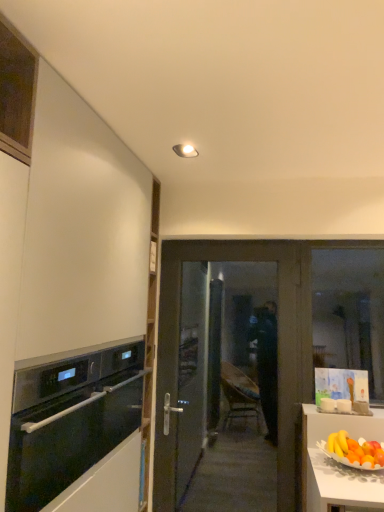
Measure the distance between orange matte grapefruit at right and camera.

The depth of orange matte grapefruit at right is 1.96 meters.

What do you see at coordinates (70, 419) in the screenshot? The height and width of the screenshot is (512, 384). I see `black glass oven at left` at bounding box center [70, 419].

The height and width of the screenshot is (512, 384). Describe the element at coordinates (185, 151) in the screenshot. I see `matte white ceiling light at upper center` at that location.

Describe the element at coordinates (350, 312) in the screenshot. Image resolution: width=384 pixels, height=512 pixels. I see `transparent glass window at right` at that location.

What is the approximate height of matte dark brown door at center?

matte dark brown door at center is 1.67 meters in height.

The height and width of the screenshot is (512, 384). Describe the element at coordinates (279, 341) in the screenshot. I see `matte dark brown door at center` at that location.

The height and width of the screenshot is (512, 384). In order to click on orange matte grapefruit at right in this screenshot , I will do `click(352, 452)`.

Is point (321, 254) closer or farther from the camera than point (185, 151)?

Point (321, 254) is positioned farther from the camera compared to point (185, 151).

Is transparent glass window at right spatially inside matte white ceiling light at upper center, or outside of it?

transparent glass window at right is not inside matte white ceiling light at upper center, it's outside.

Is transparent glass window at right facing towards matte white ceiling light at upper center?

No, transparent glass window at right is not oriented towards matte white ceiling light at upper center.

The image size is (384, 512). I want to click on window that is behind the matte white ceiling light at upper center, so click(x=350, y=312).

From the image's perspective, is transparent glass window at right on top of matte dark brown door at center?

Yes, from the image's perspective, transparent glass window at right is on top of matte dark brown door at center.

How far apart are transparent glass window at right and matte dark brown door at center?

74.02 centimeters.

Is transparent glass window at right to the left of matte dark brown door at center from the viewer's perspective?

No, transparent glass window at right is not to the left of matte dark brown door at center.

The image size is (384, 512). Identify the location of window behind the matte dark brown door at center. (350, 312).

Locate an element on the screen. window located on the right of matte dark brown door at center is located at coordinates (350, 312).

Choose the correct answer: Is matte dark brown door at center inside transparent glass window at right or outside it?

matte dark brown door at center is not enclosed by transparent glass window at right.

Based on their positions, is matte dark brown door at center located to the left or right of transparent glass window at right?

In the image, matte dark brown door at center appears on the left side of transparent glass window at right.

Does matte dark brown door at center have a lesser height compared to transparent glass window at right?

No, matte dark brown door at center is not shorter than transparent glass window at right.

Would you say black glass oven at left is to the left or to the right of orange matte grapefruit at right in the picture?

In the image, black glass oven at left appears on the left side of orange matte grapefruit at right.

Is orange matte grapefruit at right surrounded by black glass oven at left?

No, black glass oven at left does not contain orange matte grapefruit at right.

From the image's perspective, which one is positioned higher, black glass oven at left or orange matte grapefruit at right?

black glass oven at left.

Is black glass oven at left turned away from orange matte grapefruit at right?

That's not correct — black glass oven at left is not looking away from orange matte grapefruit at right.

Considering the positions of point (328, 352) and point (33, 378), is point (328, 352) closer or farther from the camera than point (33, 378)?

Point (328, 352) is positioned farther from the camera compared to point (33, 378).

From a real-world perspective, is transparent glass window at right beneath black glass oven at left?

No, from a real-world perspective, transparent glass window at right is not under black glass oven at left.

Does transparent glass window at right appear on the right side of black glass oven at left?

Correct, you'll find transparent glass window at right to the right of black glass oven at left.

Is transparent glass window at right outside of black glass oven at left?

transparent glass window at right lies outside black glass oven at left's area.

How distant is matte white ceiling light at upper center from transparent glass window at right?

The distance of matte white ceiling light at upper center from transparent glass window at right is 1.81 meters.

Considering the sizes of matte white ceiling light at upper center and transparent glass window at right in the image, is matte white ceiling light at upper center taller or shorter than transparent glass window at right?

matte white ceiling light at upper center is shorter than transparent glass window at right.

Are matte white ceiling light at upper center and transparent glass window at right beside each other?

No, matte white ceiling light at upper center is not making contact with transparent glass window at right.

Is matte white ceiling light at upper center thinner than transparent glass window at right?

No, matte white ceiling light at upper center is not thinner than transparent glass window at right.

Looking at the image, does matte dark brown door at center seem bigger or smaller compared to black glass oven at left?

In the image, matte dark brown door at center appears to be larger than black glass oven at left.

Measure the distance between matte dark brown door at center and black glass oven at left.

matte dark brown door at center is 3.34 feet away from black glass oven at left.

Considering the relative sizes of matte dark brown door at center and black glass oven at left in the image provided, is matte dark brown door at center shorter than black glass oven at left?

No, matte dark brown door at center is not shorter than black glass oven at left.

Considering the relative positions of matte dark brown door at center and black glass oven at left in the image provided, is matte dark brown door at center to the left or to the right of black glass oven at left?

matte dark brown door at center is positioned on black glass oven at left's right side.

Locate an element on the screen. This screenshot has height=512, width=384. window below the matte white ceiling light at upper center (from a real-world perspective) is located at coordinates (350, 312).

Identify the location of door on the left of transparent glass window at right. (279, 341).

Looking at this image, from the image, which object appears to be farther from black glass oven at left, orange matte grapefruit at right or matte white ceiling light at upper center?

The object further to black glass oven at left is matte white ceiling light at upper center.

Estimate the real-world distances between objects in this image. Which object is further from transparent glass window at right, black glass oven at left or matte white ceiling light at upper center?

Among the two, matte white ceiling light at upper center is located further to transparent glass window at right.

Considering their positions, is matte white ceiling light at upper center positioned further to black glass oven at left than matte dark brown door at center?

matte white ceiling light at upper center.

Which object lies nearer to the anchor point orange matte grapefruit at right, matte white ceiling light at upper center or matte dark brown door at center?

Among the two, matte dark brown door at center is located nearer to orange matte grapefruit at right.

Based on their spatial positions, is black glass oven at left or transparent glass window at right further from matte white ceiling light at upper center?

Based on the image, transparent glass window at right appears to be further to matte white ceiling light at upper center.

Which object lies further to the anchor point matte dark brown door at center, orange matte grapefruit at right or black glass oven at left?

Among the two, black glass oven at left is located further to matte dark brown door at center.

Considering their positions, is matte white ceiling light at upper center positioned closer to black glass oven at left than orange matte grapefruit at right?

orange matte grapefruit at right.

Based on their spatial positions, is orange matte grapefruit at right or matte dark brown door at center closer to matte white ceiling light at upper center?

matte dark brown door at center.

This screenshot has height=512, width=384. What are the coordinates of `window between matte white ceiling light at upper center and matte dark brown door at center in the up-down direction` in the screenshot? It's located at (350, 312).

This screenshot has height=512, width=384. In order to click on kitchen appliance between matte white ceiling light at upper center and matte dark brown door at center in the up-down direction in this screenshot , I will do `click(70, 419)`.

The height and width of the screenshot is (512, 384). I want to click on door between black glass oven at left and orange matte grapefruit at right in the horizontal direction, so click(279, 341).

Locate an element on the screen. This screenshot has width=384, height=512. door between black glass oven at left and transparent glass window at right from left to right is located at coordinates (279, 341).